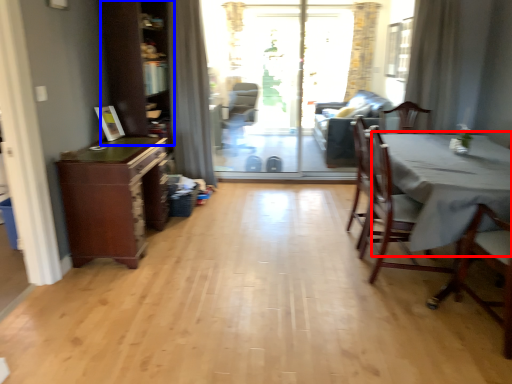
Question: Among these objects, which one is nearest to the camera, table (highlighted by a red box) or dresser (highlighted by a blue box)?

Choices:
 (A) table
 (B) dresser

Answer: (A)